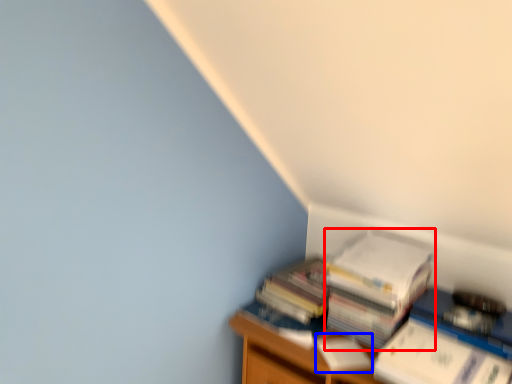
Question: Which point is closer to the camera, paperback book (highlighted by a red box) or paperback book (highlighted by a blue box)?

Choices:
 (A) paperback book
 (B) paperback book

Answer: (B)